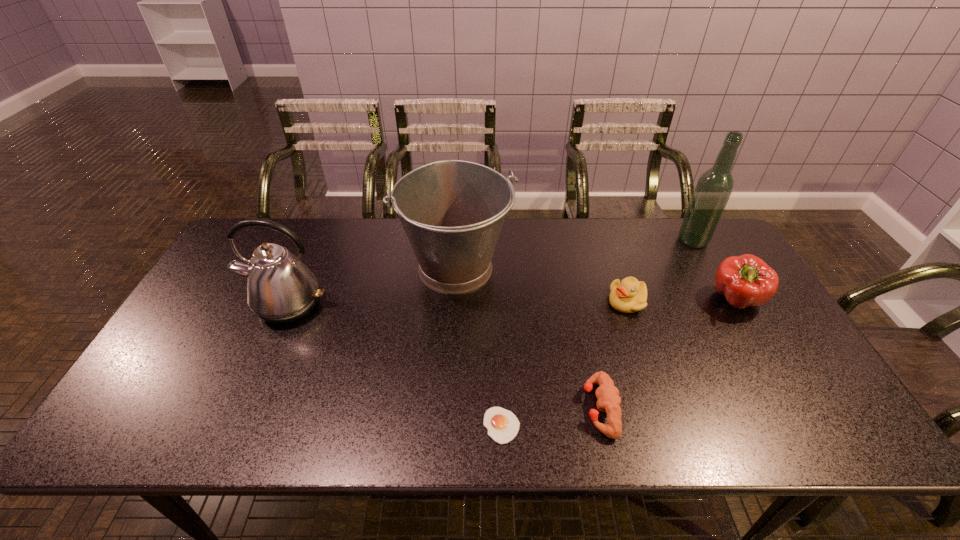
The width and height of the screenshot is (960, 540). Find the location of `vacant space at the left edge of the desktop`. vacant space at the left edge of the desktop is located at coordinates (223, 347).

I want to click on free space at the right edge of the desktop, so click(745, 322).

In order to click on free space at the near left corner of the desktop in this screenshot , I will do (162, 434).

Locate an element on the screen. free spot between the leftmost object and the egg yolk is located at coordinates (395, 365).

This screenshot has width=960, height=540. Identify the location of unoccupied position between the pepper and the duckling. (681, 301).

Find the location of a particular element. The height and width of the screenshot is (540, 960). free space between the puncher and the fourth tallest object is located at coordinates (667, 354).

Locate an element on the screen. This screenshot has height=540, width=960. empty space that is in between the kettle and the puncher is located at coordinates (444, 356).

Find the location of a particular element. Image resolution: width=960 pixels, height=540 pixels. free space between the egg yolk and the puncher is located at coordinates (551, 417).

You are a GUI agent. You are given a task and a screenshot of the screen. Output one action in this format:
    pyautogui.click(x=<x>, y=<y>)
    Task: Click on the empty location between the tallest object and the duckling
    Image resolution: width=960 pixels, height=540 pixels.
    Given the screenshot: What is the action you would take?
    pyautogui.click(x=660, y=271)

The width and height of the screenshot is (960, 540). Identify the location of free point between the egg yolk and the fourth tallest object. [618, 363].